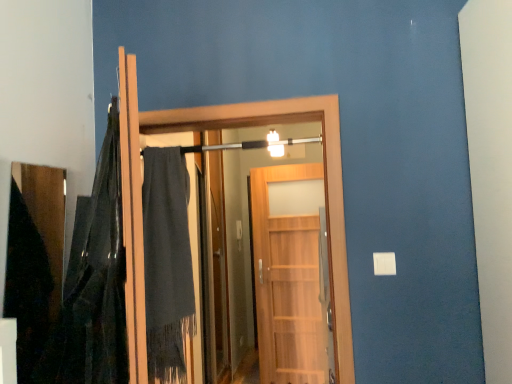
Measure the distance between wooden door at center, marked as the 2th door in a front-to-back arrangement, and camera.

wooden door at center, marked as the 2th door in a front-to-back arrangement, is 11.44 feet away from camera.

Identify the location of wooden door at center, marked as the 2th door in a front-to-back arrangement. (287, 283).

Is velvet dark gray blanket at left turned away from wooden door at center, marked as the 2th door in a front-to-back arrangement?

velvet dark gray blanket at left does not have its back to wooden door at center, marked as the 2th door in a front-to-back arrangement.

From a real-world perspective, is velvet dark gray blanket at left positioned under wooden door at center, marked as the 1th door in a back-to-front arrangement, based on gravity?

Actually, velvet dark gray blanket at left is physically above wooden door at center, marked as the 1th door in a back-to-front arrangement, in the real world.

From the image's perspective, is dark gray woolen robe at center located above or below wooden door at center, marked as the 2th door in a front-to-back arrangement?

dark gray woolen robe at center is situated higher than wooden door at center, marked as the 2th door in a front-to-back arrangement, in the image.

Does point (147, 281) come closer to viewer compared to point (318, 310)?

Yes.

From a real-world perspective, between dark gray woolen robe at center and wooden door at center, marked as the 1th door in a back-to-front arrangement, who is vertically higher?

dark gray woolen robe at center is physically above.

From a real-world perspective, who is located higher, wooden door at center, which is the 2th door from back to front, or velvet dark gray blanket at left?

velvet dark gray blanket at left is physically above.

Does wooden door at center, which is the 2th door from back to front, contain velvet dark gray blanket at left?

No, wooden door at center, which is the 2th door from back to front, does not contain velvet dark gray blanket at left.

Between wooden door at center, which is the first door from front to back, and velvet dark gray blanket at left, which one appears on the right side from the viewer's perspective?

Positioned to the right is wooden door at center, which is the first door from front to back.

How different are the orientations of wooden door at center, which is the first door from front to back, and dark gray woolen robe at center in degrees?

The angle between the facing direction of wooden door at center, which is the first door from front to back, and the facing direction of dark gray woolen robe at center is 0.00012 degrees.

From a real-world perspective, which is physically below, wooden door at center, which is the first door from front to back, or dark gray woolen robe at center?

dark gray woolen robe at center, from a real-world perspective.

Looking at this image, is wooden door at center, which is the 2th door from back to front, next to dark gray woolen robe at center and touching it?

wooden door at center, which is the 2th door from back to front, and dark gray woolen robe at center are not in contact.

Is wooden door at center, which is the 2th door from back to front, oriented away from dark gray woolen robe at center?

Yes, wooden door at center, which is the 2th door from back to front, is positioned with its back facing dark gray woolen robe at center.

Can you confirm if wooden door at center, marked as the 1th door in a back-to-front arrangement, is wider than dark gray woolen robe at center?

In fact, wooden door at center, marked as the 1th door in a back-to-front arrangement, might be narrower than dark gray woolen robe at center.

Is dark gray woolen robe at center at the back of wooden door at center, marked as the 1th door in a back-to-front arrangement?

No, wooden door at center, marked as the 1th door in a back-to-front arrangement,'s orientation is not away from dark gray woolen robe at center.

Is wooden door at center, marked as the 2th door in a front-to-back arrangement, completely or partially outside of dark gray woolen robe at center?

Absolutely, wooden door at center, marked as the 2th door in a front-to-back arrangement, is external to dark gray woolen robe at center.

Between wooden door at center, marked as the 2th door in a front-to-back arrangement, and dark gray woolen robe at center, which one appears on the right side from the viewer's perspective?

wooden door at center, marked as the 2th door in a front-to-back arrangement, is more to the right.

Locate an element on the screen. robe that appears below the wooden door at center, which is the first door from front to back (from a real-world perspective) is located at coordinates [167, 263].

What's the angular difference between dark gray woolen robe at center and wooden door at center, which is the 2th door from back to front,'s facing directions?

They differ by 0.00012 degrees in their facing directions.

Could you tell me if dark gray woolen robe at center is turned towards wooden door at center, which is the first door from front to back?

Yes, dark gray woolen robe at center is aimed at wooden door at center, which is the first door from front to back.

From a real-world perspective, is dark gray woolen robe at center under wooden door at center, which is the 2th door from back to front?

Indeed, from a real-world perspective, dark gray woolen robe at center is positioned beneath wooden door at center, which is the 2th door from back to front.

Is dark gray woolen robe at center closer to camera compared to velvet dark gray blanket at left?

No, dark gray woolen robe at center is further to the viewer.

Is dark gray woolen robe at center thinner than velvet dark gray blanket at left?

No.

Is dark gray woolen robe at center placed right next to velvet dark gray blanket at left?

No, dark gray woolen robe at center is not next to velvet dark gray blanket at left.

How many degrees apart are the facing directions of dark gray woolen robe at center and velvet dark gray blanket at left?

The angular difference between dark gray woolen robe at center and velvet dark gray blanket at left is 115 degrees.

Where is `blanket on the left side of wooden door at center, marked as the 1th door in a back-to-front arrangement`? The image size is (512, 384). blanket on the left side of wooden door at center, marked as the 1th door in a back-to-front arrangement is located at coordinates coord(97,277).

Which door is the 2nd one when counting from the right side of the dark gray woolen robe at center? Please provide its 2D coordinates.

[(287, 283)]

Estimate the real-world distances between objects in this image. Which object is closer to wooden door at center, marked as the 1th door in a back-to-front arrangement, wooden door at center, which is the 2th door from back to front, or dark gray woolen robe at center?

dark gray woolen robe at center lies closer to wooden door at center, marked as the 1th door in a back-to-front arrangement, than the other object.

Which object lies nearer to the anchor point wooden door at center, which is the 2th door from back to front, velvet dark gray blanket at left or wooden door at center, marked as the 2th door in a front-to-back arrangement?

Based on the image, velvet dark gray blanket at left appears to be nearer to wooden door at center, which is the 2th door from back to front.

When comparing their distances from dark gray woolen robe at center, does velvet dark gray blanket at left or wooden door at center, marked as the 2th door in a front-to-back arrangement, seem further?

wooden door at center, marked as the 2th door in a front-to-back arrangement, is further to dark gray woolen robe at center.

Looking at this image, looking at the image, which one is located closer to dark gray woolen robe at center, wooden door at center, which is the 2th door from back to front, or wooden door at center, marked as the 1th door in a back-to-front arrangement?

wooden door at center, which is the 2th door from back to front, is closer to dark gray woolen robe at center.

Based on their spatial positions, is dark gray woolen robe at center or wooden door at center, which is the 2th door from back to front, further from wooden door at center, marked as the 1th door in a back-to-front arrangement?

The object further to wooden door at center, marked as the 1th door in a back-to-front arrangement, is wooden door at center, which is the 2th door from back to front.

Based on their spatial positions, is dark gray woolen robe at center or velvet dark gray blanket at left further from wooden door at center, which is the 2th door from back to front?

The object further to wooden door at center, which is the 2th door from back to front, is velvet dark gray blanket at left.

From the image, which object appears to be farther from wooden door at center, which is the first door from front to back, velvet dark gray blanket at left or dark gray woolen robe at center?

velvet dark gray blanket at left is positioned further to the anchor wooden door at center, which is the first door from front to back.

From the image, which object appears to be nearer to dark gray woolen robe at center, velvet dark gray blanket at left or wooden door at center, which is the first door from front to back?

Among the two, wooden door at center, which is the first door from front to back, is located nearer to dark gray woolen robe at center.

The width and height of the screenshot is (512, 384). In order to click on robe between wooden door at center, which is the first door from front to back, and wooden door at center, marked as the 2th door in a front-to-back arrangement, in the front-back direction in this screenshot , I will do `click(167, 263)`.

The image size is (512, 384). Identify the location of robe between velvet dark gray blanket at left and wooden door at center, marked as the 1th door in a back-to-front arrangement, from front to back. (167, 263).

This screenshot has width=512, height=384. I want to click on door positioned between velvet dark gray blanket at left and dark gray woolen robe at center from near to far, so click(220, 128).

Find the location of `door between velvet dark gray blanket at left and wooden door at center, marked as the 2th door in a front-to-back arrangement, along the z-axis`. door between velvet dark gray blanket at left and wooden door at center, marked as the 2th door in a front-to-back arrangement, along the z-axis is located at coordinates (220, 128).